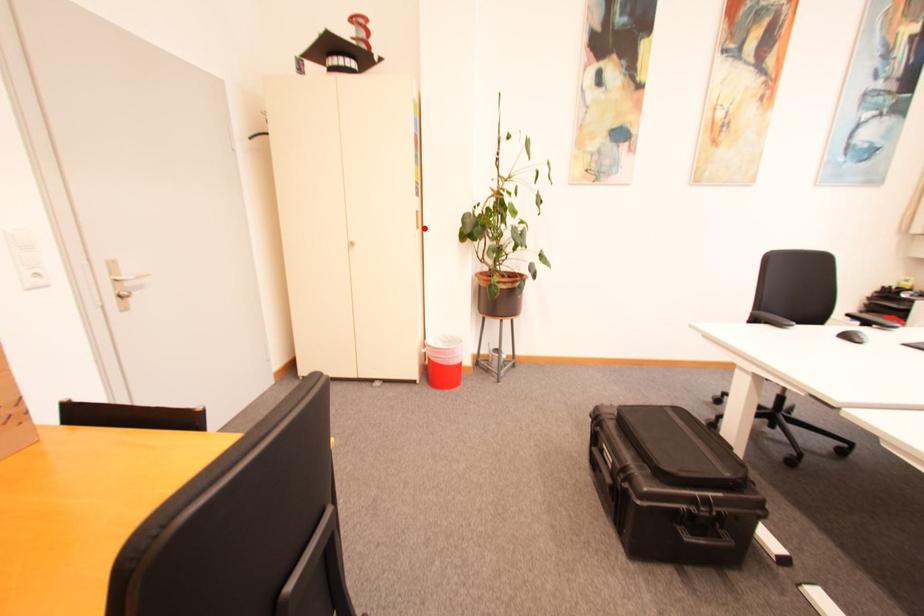
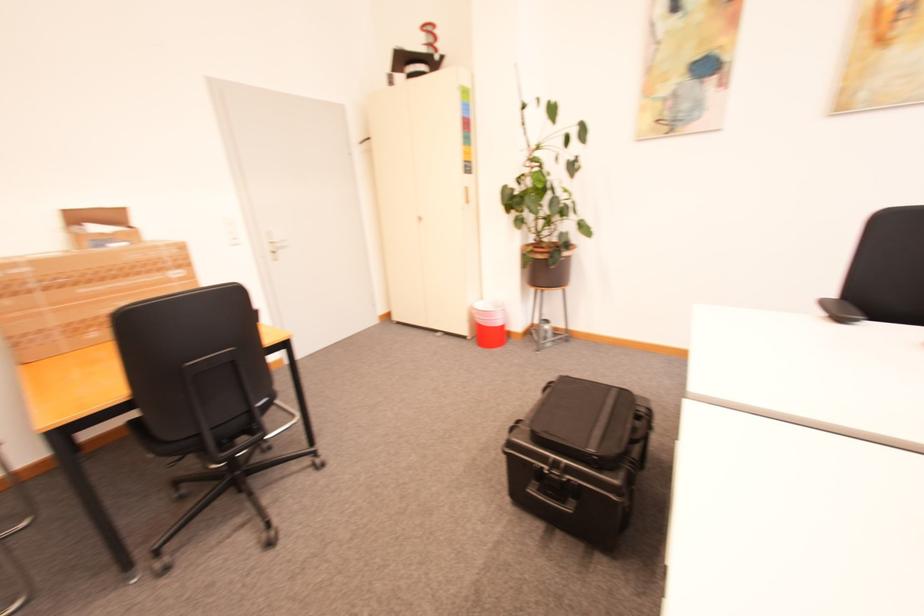
Locate, in the second image, the point that corresponds to the highlighted location in the first image.

(473, 203)